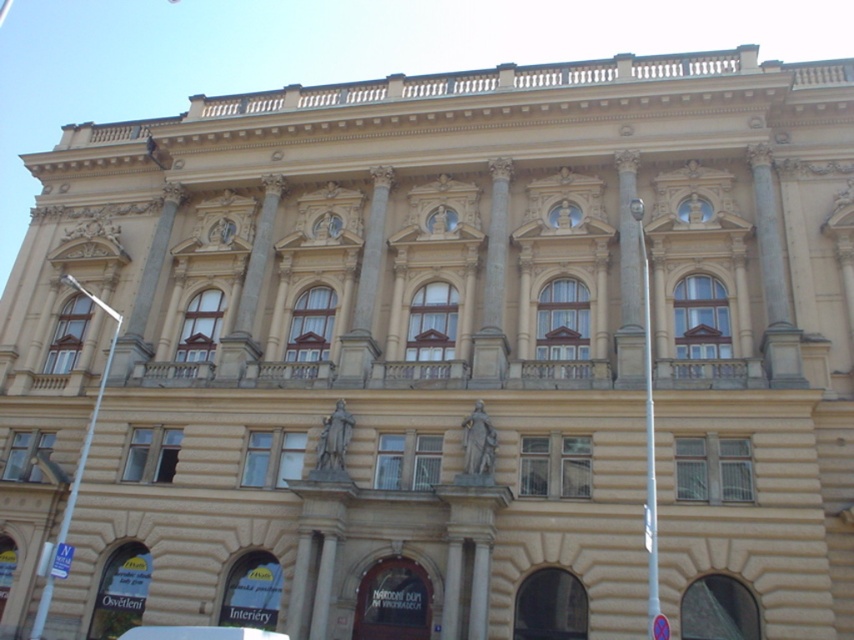
Question: Is white marble pillar at center above beige stone column at center?

Choices:
 (A) yes
 (B) no

Answer: (A)

Question: Which point is farther to the camera?

Choices:
 (A) white marble pillar at center
 (B) metallic silver car at lower center

Answer: (A)

Question: Which point appears farthest from the camera in this image?

Choices:
 (A) (221, 632)
 (B) (449, 588)
 (C) (472, 554)

Answer: (C)

Question: Estimate the real-world distances between objects in this image. Which object is farther from the metallic silver car at lower center?

Choices:
 (A) beige stone pillar at center
 (B) white marble pillar at center

Answer: (B)

Question: From the image, what is the correct spatial relationship of metallic silver car at lower center in relation to beige stone pillar at center?

Choices:
 (A) above
 (B) below

Answer: (B)

Question: Is white marble pillar at center below beige stone column at center?

Choices:
 (A) no
 (B) yes

Answer: (A)